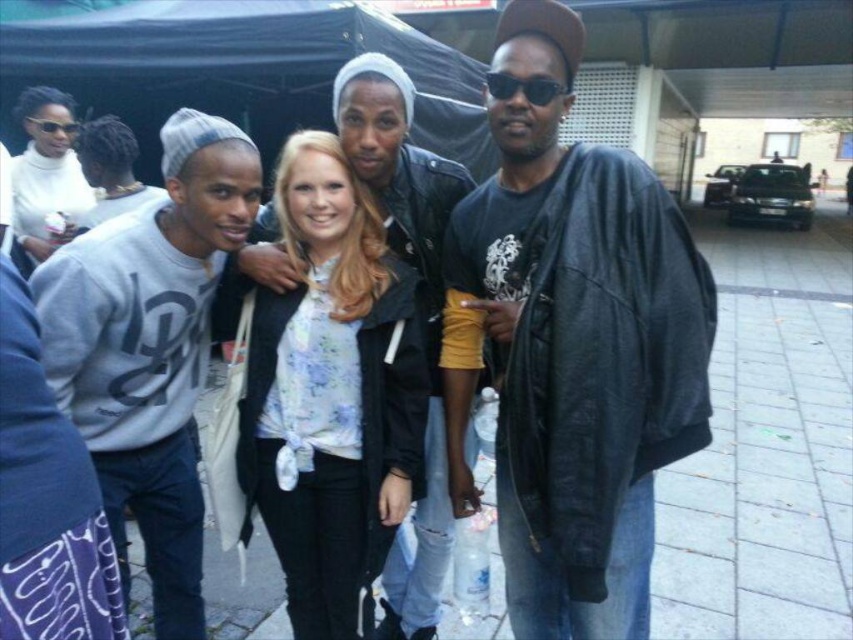
You are a fashion designer observing the group under the black canopy. You need to determine which clothing item, the dark gray leather jacket at center or the gray cotton sweatshirt at left, would require more fabric to make based on their size in the image. Which one?

The dark gray leather jacket at center is taller than the gray cotton sweatshirt at left, so it would require more fabric to make.

You are a tailor who needs to know the relative sizes of the clothing items in the image. Which clothing item is narrower between the gray cotton sweatshirt at left and the white matte sweater at upper left?

The gray cotton sweatshirt at left has a lesser width compared to the white matte sweater at upper left, so the gray cotton sweatshirt at left is narrower.

What object is located at the coordinates point (151, 348)?

The point (151, 348) marks the gray cotton sweatshirt at left.